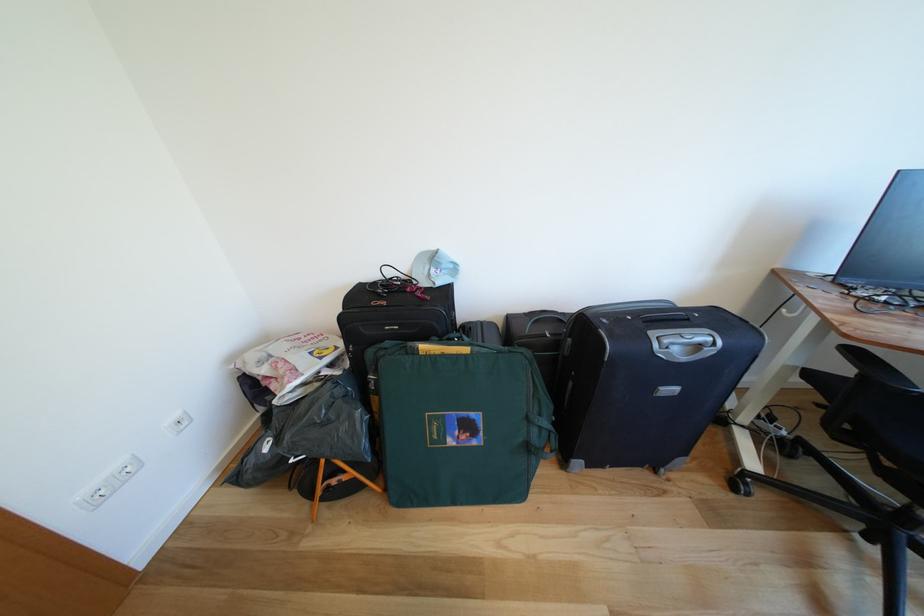
What do you see at coordinates (874, 367) in the screenshot?
I see `the black chair armrest` at bounding box center [874, 367].